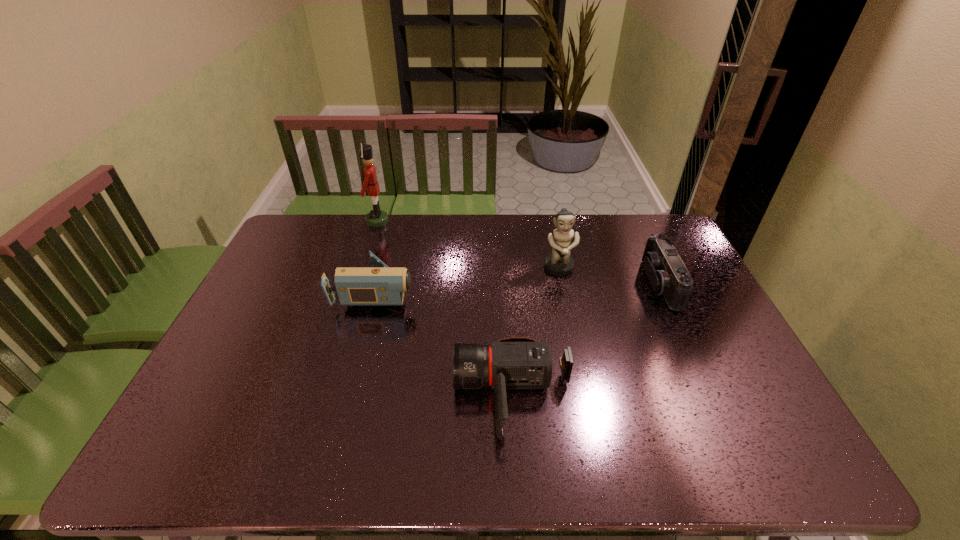
Locate an element on the screen. free space located 0.340m on the front-facing side of the rightmost camcorder is located at coordinates (540, 284).

Where is `vacant space located on the front-facing side of the rightmost camcorder`? vacant space located on the front-facing side of the rightmost camcorder is located at coordinates (571, 284).

Locate an element on the screen. vacant point located on the front-facing side of the rightmost camcorder is located at coordinates (589, 284).

The image size is (960, 540). I want to click on vacant space located on the lens of the nearest camcorder, so click(x=434, y=396).

Image resolution: width=960 pixels, height=540 pixels. Find the location of `vacant space located 0.200m on the lens of the nearest camcorder`. vacant space located 0.200m on the lens of the nearest camcorder is located at coordinates (374, 396).

Locate an element on the screen. This screenshot has width=960, height=540. vacant region located on the lens of the nearest camcorder is located at coordinates (319, 396).

Identify the location of object present at the far edge. The height and width of the screenshot is (540, 960). (375, 218).

At what (x,y) coordinates should I click in order to perform the action: click on object at the near edge. Please return your answer as a coordinate pair (x, y). Looking at the image, I should click on (516, 362).

Locate an element on the screen. This screenshot has width=960, height=540. object that is positioned at the right edge is located at coordinates (668, 275).

The width and height of the screenshot is (960, 540). What are the coordinates of `free space at the far edge of the desktop` in the screenshot? It's located at (506, 219).